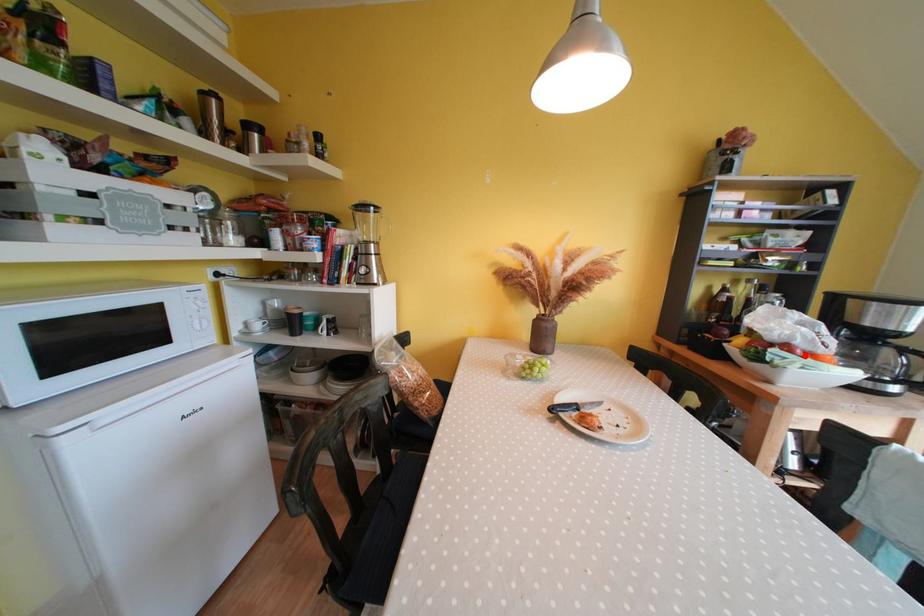
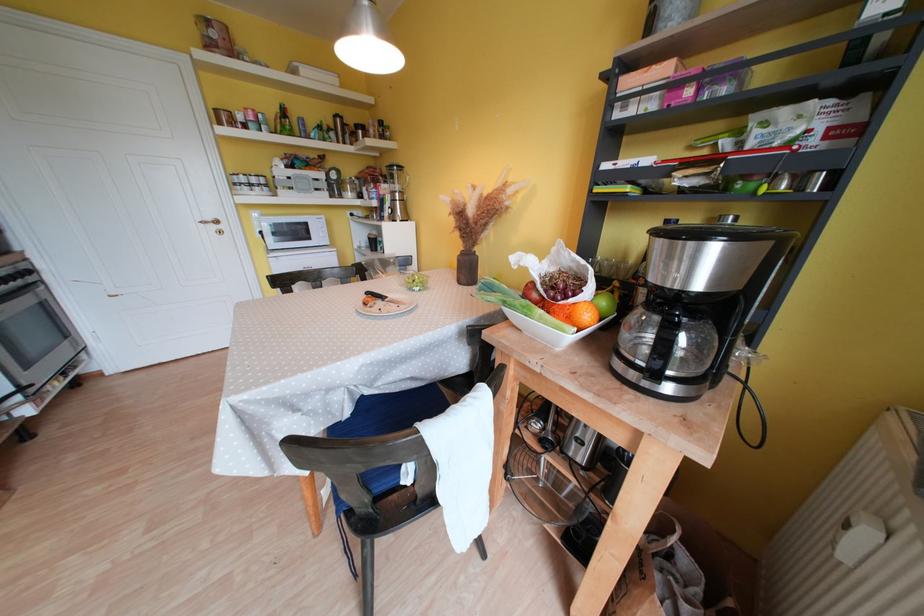
Find the pixel in the second image that matches the highlighted location in the first image.

(541, 299)